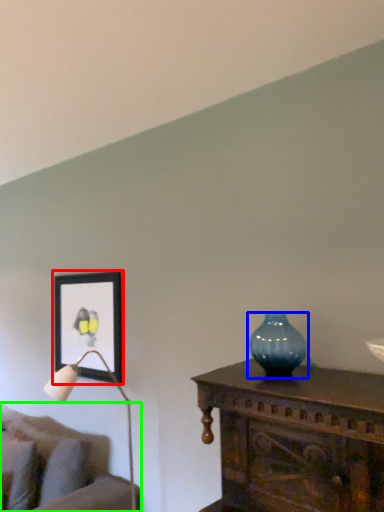
Question: Considering the real-world distances, which object is closest to picture frame (highlighted by a red box)? vase (highlighted by a blue box) or studio couch (highlighted by a green box).

Choices:
 (A) vase
 (B) studio couch

Answer: (B)